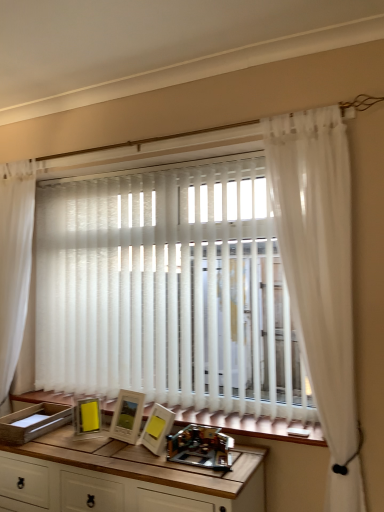
This screenshot has height=512, width=384. Describe the element at coordinates (157, 428) in the screenshot. I see `matte wooden picture frame at center, positioned as the 3th picture frame in left-to-right order` at that location.

Measure the distance between point (163, 444) and camera.

Point (163, 444) and camera are 1.84 meters apart.

The image size is (384, 512). Find the location of `metallic silver picture frame at lower left, the 3th picture frame when ordered from right to left`. metallic silver picture frame at lower left, the 3th picture frame when ordered from right to left is located at coordinates (87, 416).

The height and width of the screenshot is (512, 384). I want to click on metallic plastic toy at center, so click(201, 447).

Which point is more forward, [4,251] or [19,489]?

The point [19,489] is more forward.

Can you confirm if white sheer curtain at left, the 1th curtain in the left-to-right sequence, is thinner than wooden table at center?

Yes.

From a real-world perspective, is white sheer curtain at left, the 1th curtain in the left-to-right sequence, over wooden table at center?

Yes.

Considering the sizes of objects white sheer curtain at left, which ranks as the second curtain in front-to-back order, and wooden table at center in the image provided, who is smaller, white sheer curtain at left, which ranks as the second curtain in front-to-back order, or wooden table at center?

Smaller between the two is white sheer curtain at left, which ranks as the second curtain in front-to-back order.

Is metallic silver picture frame at lower left, which is the first picture frame in left-to-right order, directly adjacent to white sheer curtain at left, the 1th curtain in the left-to-right sequence?

They are not placed beside each other.

Considering the sizes of metallic silver picture frame at lower left, the 3th picture frame when ordered from right to left, and white sheer curtain at left, which is counted as the 1th curtain, starting from the back, in the image, is metallic silver picture frame at lower left, the 3th picture frame when ordered from right to left, bigger or smaller than white sheer curtain at left, which is counted as the 1th curtain, starting from the back,?

Clearly, metallic silver picture frame at lower left, the 3th picture frame when ordered from right to left, is smaller in size than white sheer curtain at left, which is counted as the 1th curtain, starting from the back.

Is metallic silver picture frame at lower left, the 3th picture frame when ordered from right to left, located outside white sheer curtain at left, which ranks as the 2th curtain in right-to-left order?

Yes.

Which object is positioned more to the left, metallic silver picture frame at lower left, the 3th picture frame when ordered from right to left, or white sheer curtain at left, which ranks as the second curtain in front-to-back order?

Positioned to the left is white sheer curtain at left, which ranks as the second curtain in front-to-back order.

From the image's perspective, is matte white picture frame at center, marked as the second picture frame in a right-to-left arrangement, located above or below wooden table at center?

From the image's perspective, matte white picture frame at center, marked as the second picture frame in a right-to-left arrangement, appears above wooden table at center.

Is matte white picture frame at center, placed as the second picture frame when sorted from left to right, to the left or to the right of wooden table at center in the image?

matte white picture frame at center, placed as the second picture frame when sorted from left to right, is positioned on wooden table at center's right side.

Considering the sizes of objects matte white picture frame at center, marked as the second picture frame in a right-to-left arrangement, and wooden table at center in the image provided, who is taller, matte white picture frame at center, marked as the second picture frame in a right-to-left arrangement, or wooden table at center?

wooden table at center is taller.

Is matte white picture frame at center, placed as the second picture frame when sorted from left to right, oriented away from wooden table at center?

No, matte white picture frame at center, placed as the second picture frame when sorted from left to right, is not facing away from wooden table at center.

Is matte wooden picture frame at center, the first picture frame from the right, located within white sheer curtain at left, which ranks as the 2th curtain in right-to-left order?

Actually, matte wooden picture frame at center, the first picture frame from the right, is outside white sheer curtain at left, which ranks as the 2th curtain in right-to-left order.

From the image's perspective, which is above, white sheer curtain at left, the 1th curtain in the left-to-right sequence, or matte wooden picture frame at center, the first picture frame from the right?

From the image's view, white sheer curtain at left, the 1th curtain in the left-to-right sequence, is above.

Which of these two, white sheer curtain at left, which ranks as the 2th curtain in right-to-left order, or matte wooden picture frame at center, positioned as the 3th picture frame in left-to-right order, is smaller?

matte wooden picture frame at center, positioned as the 3th picture frame in left-to-right order, is smaller.

Can you confirm if white sheer curtain at left, which ranks as the 2th curtain in right-to-left order, is thinner than matte wooden picture frame at center, the first picture frame from the right?

No, white sheer curtain at left, which ranks as the 2th curtain in right-to-left order, is not thinner than matte wooden picture frame at center, the first picture frame from the right.

You are a GUI agent. You are given a task and a screenshot of the screen. Output one action in this format:
    pyautogui.click(x=<x>, y=<y>)
    Task: Click on the window sill below the matte white picture frame at center, marked as the second picture frame in a right-to-left arrangement (from a real-world perspective)
    The width and height of the screenshot is (384, 512).
    Given the screenshot: What is the action you would take?
    pyautogui.click(x=251, y=425)

Between point (206, 422) and point (121, 395), which one is positioned behind?

The point (121, 395) is more distant.

Is wooden at lower center looking in the opposite direction of matte white picture frame at center, marked as the second picture frame in a right-to-left arrangement?

No, matte white picture frame at center, marked as the second picture frame in a right-to-left arrangement, is not at the back of wooden at lower center.

Considering the relative sizes of wooden at lower center and matte white picture frame at center, marked as the second picture frame in a right-to-left arrangement, in the image provided, is wooden at lower center bigger than matte white picture frame at center, marked as the second picture frame in a right-to-left arrangement,?

Yes, wooden at lower center is bigger than matte white picture frame at center, marked as the second picture frame in a right-to-left arrangement.

Consider the image. Measure the distance between matte wooden picture frame at center, positioned as the 3th picture frame in left-to-right order, and white sheer curtain at right, which is the first curtain from front to back.

A distance of 36.96 inches exists between matte wooden picture frame at center, positioned as the 3th picture frame in left-to-right order, and white sheer curtain at right, which is the first curtain from front to back.

Does point (144, 443) appear closer or farther from the camera than point (291, 134)?

Point (144, 443) appears to be farther away from the viewer than point (291, 134).

Does matte wooden picture frame at center, the first picture frame from the right, come behind white sheer curtain at right, the 1th curtain when ordered from right to left?

Yes, matte wooden picture frame at center, the first picture frame from the right, is further from the camera.

Considering the sizes of matte wooden picture frame at center, the first picture frame from the right, and white sheer curtain at right, the second curtain positioned from the left, in the image, is matte wooden picture frame at center, the first picture frame from the right, wider or thinner than white sheer curtain at right, the second curtain positioned from the left,?

Clearly, matte wooden picture frame at center, the first picture frame from the right, has less width compared to white sheer curtain at right, the second curtain positioned from the left.

In the scene shown: Is matte white picture frame at center, marked as the second picture frame in a right-to-left arrangement, positioned behind metallic plastic toy at center?

Yes, matte white picture frame at center, marked as the second picture frame in a right-to-left arrangement, is further from the viewer.

Between point (136, 429) and point (176, 461), which one is positioned behind?

The point (136, 429) is more distant.

Where is `toy in front of the matte white picture frame at center, placed as the second picture frame when sorted from left to right`? The width and height of the screenshot is (384, 512). toy in front of the matte white picture frame at center, placed as the second picture frame when sorted from left to right is located at coordinates (201, 447).

Which object is positioned more to the right, matte white picture frame at center, placed as the second picture frame when sorted from left to right, or metallic plastic toy at center?

Positioned to the right is metallic plastic toy at center.

There is a wooden table at center. At what (x,y) coordinates should I click in order to perform the action: click on the 2nd curtain above it (from a real-world perspective). Please return your answer as a coordinate pair (x, y). The height and width of the screenshot is (512, 384). Looking at the image, I should click on (14, 262).

Locate an element on the screen. This screenshot has height=512, width=384. curtain that is on the left side of metallic silver picture frame at lower left, the 3th picture frame when ordered from right to left is located at coordinates (14, 262).

Considering their positions, is white sheer curtain at right, the second curtain when ordered from back to front, positioned closer to metallic silver picture frame at lower left, the 3th picture frame when ordered from right to left, than matte white picture frame at center, placed as the second picture frame when sorted from left to right?

matte white picture frame at center, placed as the second picture frame when sorted from left to right, is closer to metallic silver picture frame at lower left, the 3th picture frame when ordered from right to left.

Which object lies nearer to the anchor point matte white picture frame at center, placed as the second picture frame when sorted from left to right, white sheer curtain at left, which ranks as the 2th curtain in right-to-left order, or white sheer curtain at right, the 1th curtain when ordered from right to left?

white sheer curtain at left, which ranks as the 2th curtain in right-to-left order, lies closer to matte white picture frame at center, placed as the second picture frame when sorted from left to right, than the other object.

Considering their positions, is white sheer curtain at right, the second curtain when ordered from back to front, positioned closer to metallic plastic toy at center than white sheer curtain at left, which ranks as the 2th curtain in right-to-left order?

white sheer curtain at right, the second curtain when ordered from back to front.

Considering their positions, is matte wooden picture frame at center, positioned as the 3th picture frame in left-to-right order, positioned closer to metallic plastic toy at center than white sheer curtain at right, the second curtain when ordered from back to front?

Based on the image, matte wooden picture frame at center, positioned as the 3th picture frame in left-to-right order, appears to be nearer to metallic plastic toy at center.

Based on the photo, which object lies nearer to the anchor point matte wooden picture frame at center, positioned as the 3th picture frame in left-to-right order, metallic plastic toy at center or metallic silver picture frame at lower left, the 3th picture frame when ordered from right to left?

metallic plastic toy at center.

From the image, which object appears to be farther from matte white picture frame at center, marked as the second picture frame in a right-to-left arrangement, matte wooden picture frame at center, positioned as the 3th picture frame in left-to-right order, or metallic plastic toy at center?

Based on the image, metallic plastic toy at center appears to be further to matte white picture frame at center, marked as the second picture frame in a right-to-left arrangement.

Which object lies nearer to the anchor point wooden at lower center, metallic plastic toy at center or white sheer curtain at left, the 1th curtain in the left-to-right sequence?

Based on the image, metallic plastic toy at center appears to be nearer to wooden at lower center.

Based on their spatial positions, is metallic silver picture frame at lower left, which is the first picture frame in left-to-right order, or wooden table at center closer to wooden at lower center?

The object closer to wooden at lower center is wooden table at center.

Where is `window sill between matte white picture frame at center, marked as the second picture frame in a right-to-left arrangement, and metallic plastic toy at center`? Image resolution: width=384 pixels, height=512 pixels. window sill between matte white picture frame at center, marked as the second picture frame in a right-to-left arrangement, and metallic plastic toy at center is located at coordinates (251, 425).

I want to click on window sill situated between metallic silver picture frame at lower left, the 3th picture frame when ordered from right to left, and metallic plastic toy at center from left to right, so click(251, 425).

Identify the location of toy between matte wooden picture frame at center, positioned as the 3th picture frame in left-to-right order, and white sheer curtain at right, which is the first curtain from front to back. (201, 447).

Where is `picture frame between wooden at lower center and metallic plastic toy at center from left to right`? This screenshot has width=384, height=512. picture frame between wooden at lower center and metallic plastic toy at center from left to right is located at coordinates (157, 428).